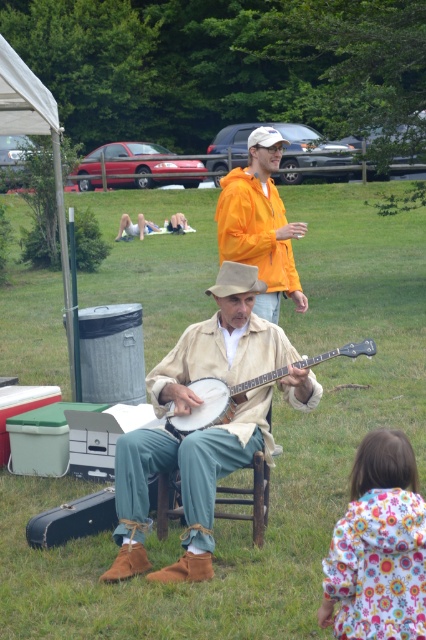
Does leather banjo at center appear on the left side of floral fabric coat at lower right?

Yes, leather banjo at center is to the left of floral fabric coat at lower right.

The width and height of the screenshot is (426, 640). What do you see at coordinates (184, 484) in the screenshot?
I see `leather banjo at center` at bounding box center [184, 484].

Who is more distant from viewer, (154, 396) or (351, 497)?

Point (154, 396)

Find the location of a particular element. leather banjo at center is located at coordinates (x=184, y=484).

Is point (273, 305) closer to viewer compared to point (264, 289)?

No, (273, 305) is behind (264, 289).

How far apart are orange matte jacket at upper center and beige felt cowboy hat at center?

orange matte jacket at upper center and beige felt cowboy hat at center are 1.93 meters apart from each other.

Does point (264, 196) come in front of point (222, 282)?

No, it is not.

At what (x,y) coordinates should I click in order to perform the action: click on orange matte jacket at upper center. Please return your answer as a coordinate pair (x, y). Looking at the image, I should click on (259, 224).

Does orange matte jacket at upper center appear over wooden banjo at center?

Yes.

Is orange matte jacket at upper center to the left of wooden banjo at center from the viewer's perspective?

Yes, orange matte jacket at upper center is to the left of wooden banjo at center.

Locate an element on the screen. This screenshot has width=426, height=640. orange matte jacket at upper center is located at coordinates (259, 224).